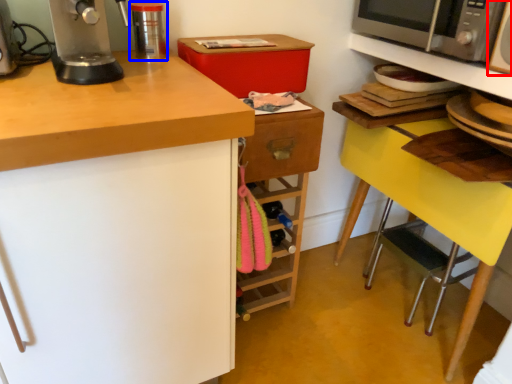
Question: Which point is further to the camera, appliance (highlighted by a red box) or kitchen appliance (highlighted by a blue box)?

Choices:
 (A) appliance
 (B) kitchen appliance

Answer: (B)